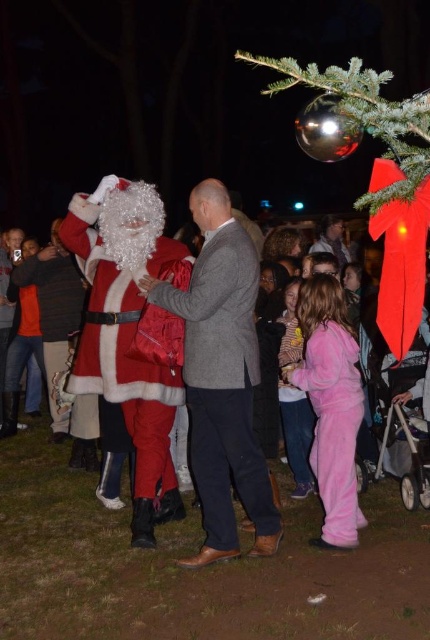
You are organizing a photo shoot and need to place a 1.2 meter wide backdrop behind both the fuzzy red santa at left and the pink fleece pants at lower center. Will the backdrop be wide enough to cover both objects?

The fuzzy red santa at left is wider than the pink fleece pants at lower center. Since the backdrop is 1.2 meters wide, it should be sufficient to cover both objects as long as their combined width does not exceed the backdrop width. However, without knowing the exact widths of each object, we can only confirm that the Santa is wider than the pink fleece pants, but cannot definitively determine if the total width fits within 1.2 meters.

You are a photographer at the event and want to take a picture of the fuzzy red santa at left and the pink fleece pants at lower center. Which of the two is positioned to the left?

The fuzzy red santa at left is positioned to the left of the pink fleece pants at lower center, so the fuzzy red santa at left is the one on the left side.